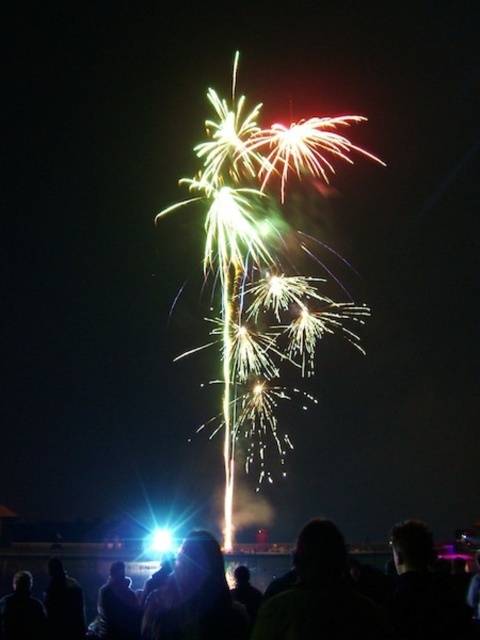
You are standing in the crowd watching the fireworks. You notice two bright points in the sky, one at point (358, 550) and another at point (210, 611). Which point do you think is closer to you?

Point (358, 550) is further to the viewer than point (210, 611), so the point at (210, 611) is closer to you.

You are a photographer trying to capture the fireworks display. You notice the black matte crowd at lower center and the black matte person at lower center in your frame. Which of the two would you need to zoom out to include fully in your shot?

The black matte crowd at lower center is bigger than the black matte person at lower center, so you would need to zoom out to include the black matte crowd at lower center fully in your shot.

Consider the image. You are a photographer trying to capture the fireworks display. You want to ensure the black matte crowd at lower center is centered in your photo. What adjustment should you make to the camera position?

To center the black matte crowd at lower center, you should move the camera upwards since the crowd is positioned at point 0.884 on the y axis, which is closer to the bottom of the image. Moving the camera upward will bring the crowd closer to the center of the frame.